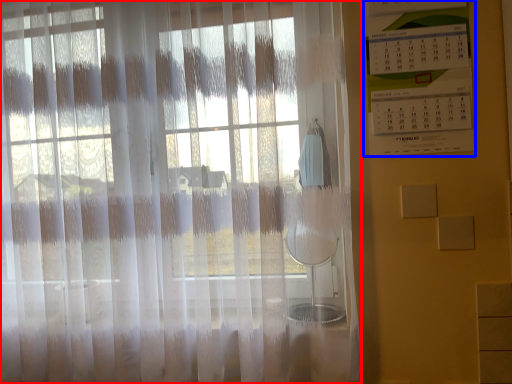
Question: Which object is further to the camera taking this photo, curtain (highlighted by a red box) or bulletin board (highlighted by a blue box)?

Choices:
 (A) curtain
 (B) bulletin board

Answer: (B)